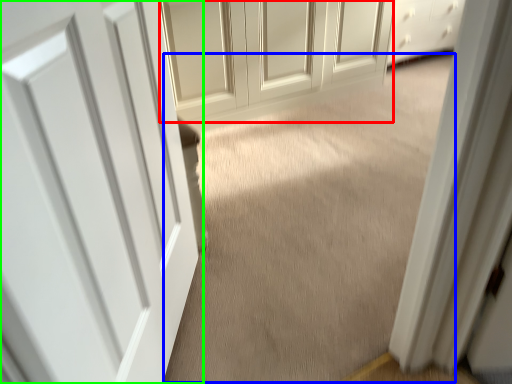
Question: Which is nearer to the door (highlighted by a red box)? plain (highlighted by a blue box) or door (highlighted by a green box).

Choices:
 (A) plain
 (B) door

Answer: (A)